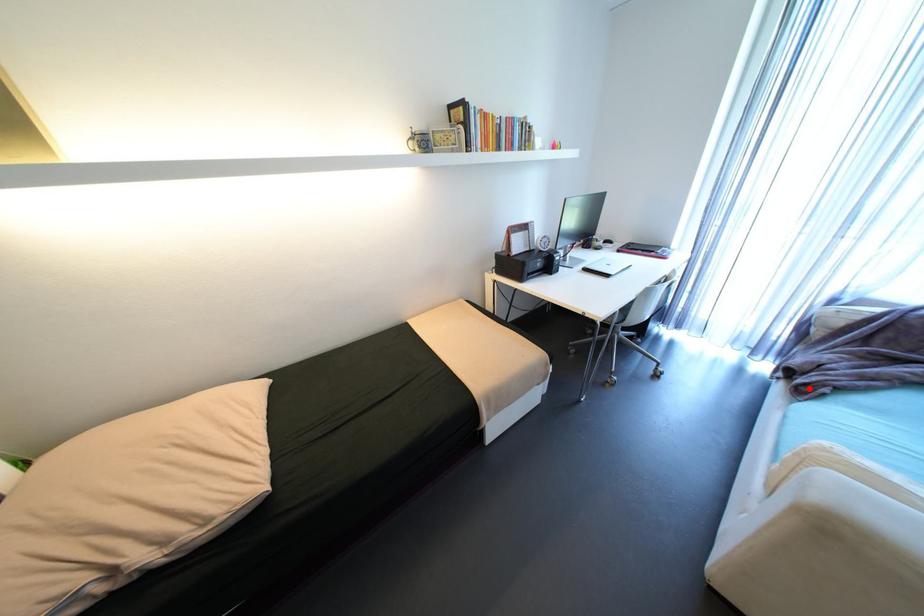
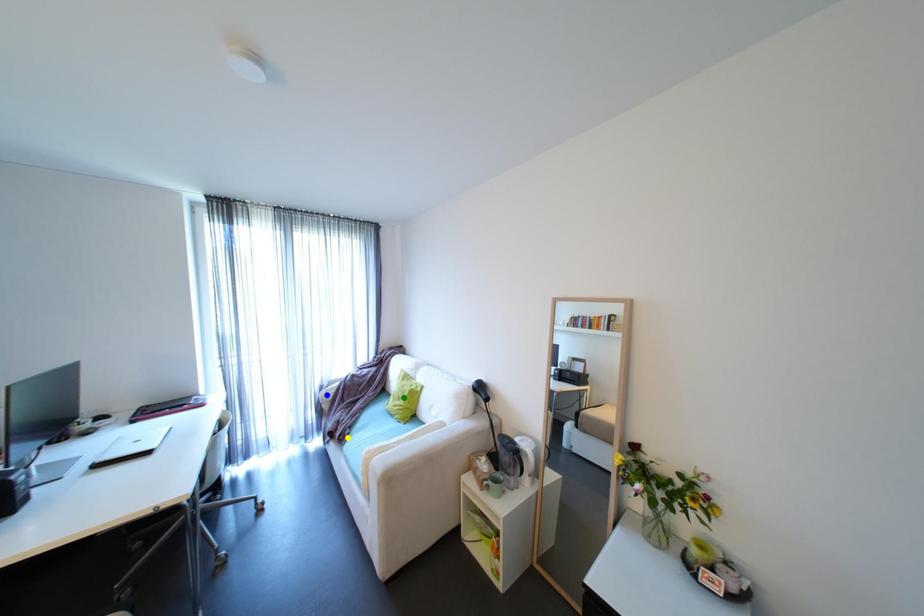
Question: I am providing you with two images of the same scene from different viewpoints. A red point is marked on the first image. You are given multiple points on the second image. Which spot in image 2 lines up with the point in image 1?

Choices:
 (A) green point
 (B) yellow point
 (C) blue point

Answer: (B)